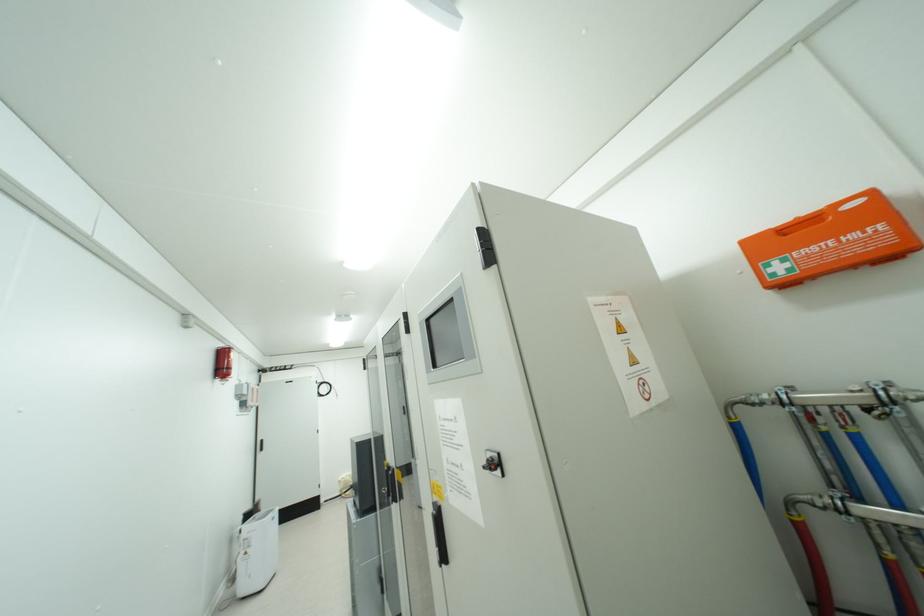
This screenshot has width=924, height=616. I want to click on black selector switch, so click(x=492, y=463).